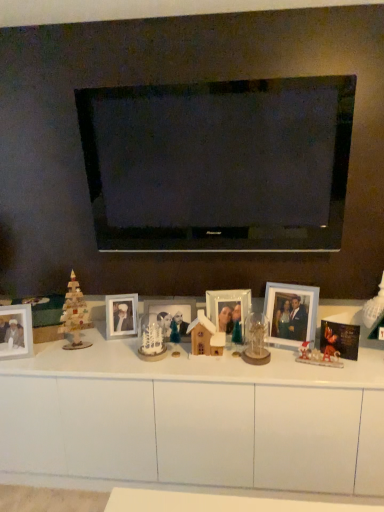
At what (x,y) coordinates should I click in order to perform the action: click on free space in front of wooden christmas tree at left. Please return your answer as a coordinate pair (x, y). Looking at the image, I should click on (72, 360).